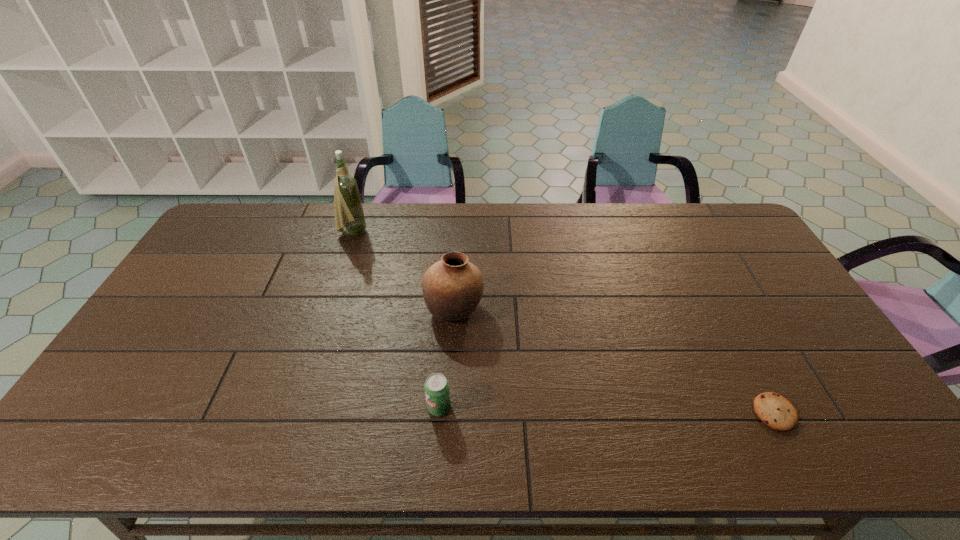
Locate an element on the screen. The width and height of the screenshot is (960, 540). free space that satisfies the following two spatial constraints: 1. on the front-facing side of the farthest object; 2. on the right side of the second tallest object is located at coordinates (328, 309).

This screenshot has width=960, height=540. I want to click on free region that satisfies the following two spatial constraints: 1. on the front-facing side of the third tallest object; 2. on the left side of the tallest object, so click(295, 407).

Find the location of a particular element. The image size is (960, 540). free spot that satisfies the following two spatial constraints: 1. on the front-facing side of the wine bottle; 2. on the back side of the third tallest object is located at coordinates (295, 407).

At what (x,y) coordinates should I click in order to perform the action: click on vacant region that satisfies the following two spatial constraints: 1. on the front-facing side of the leftmost object; 2. on the back side of the soda. Please return your answer as a coordinate pair (x, y). The image size is (960, 540). Looking at the image, I should click on (295, 407).

Locate an element on the screen. This screenshot has width=960, height=540. blank area in the image that satisfies the following two spatial constraints: 1. on the front-facing side of the tallest object; 2. on the back side of the soda is located at coordinates (295, 407).